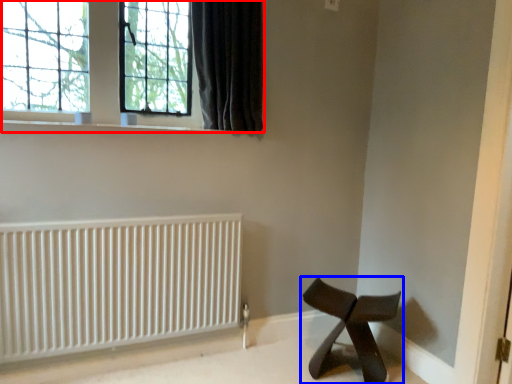
Question: Which of the following is the farthest to the observer, window (highlighted by a red box) or furniture (highlighted by a blue box)?

Choices:
 (A) window
 (B) furniture

Answer: (A)